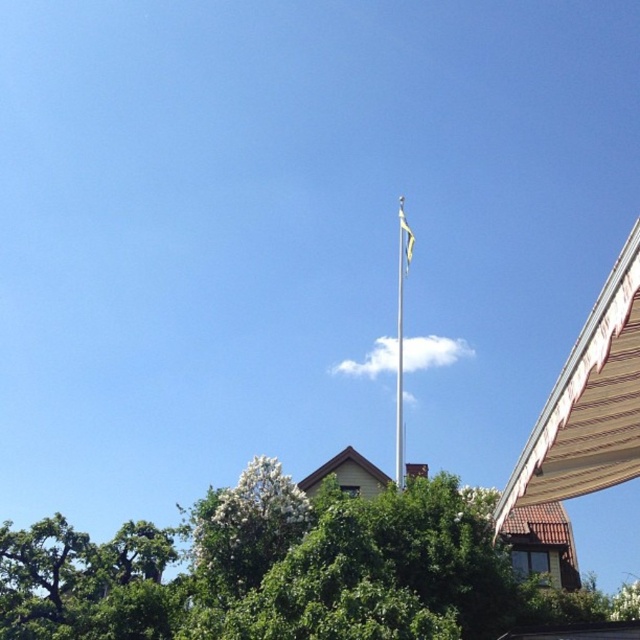
Based on the photo, you are standing in the middle of the park and see the green leafy tree at center and the yellow fabric flag at upper center. Which object is closer to the ground?

The green leafy tree at center is closer to the ground because it is located below the yellow fabric flag at upper center.

You are planning to plant a new tree in your backyard. The space you have is just enough for a tree that is narrower than the yellow fabric flag at upper center. Based on the scene, can the green leafy tree at center fit in your space?

The green leafy tree at center is wider than the yellow fabric flag at upper center, so it cannot fit in the space allocated for a narrower tree.

You are standing at the center of the image and want to locate the silver metallic flag pole at upper center. According to the coordinates provided, is it closer to the top or the bottom of the image?

The silver metallic flag pole at upper center is located at coordinates point (401, 330). Since the y coordinate 0.627 is closer to 1.0 than to 0.0, it is closer to the top of the image.